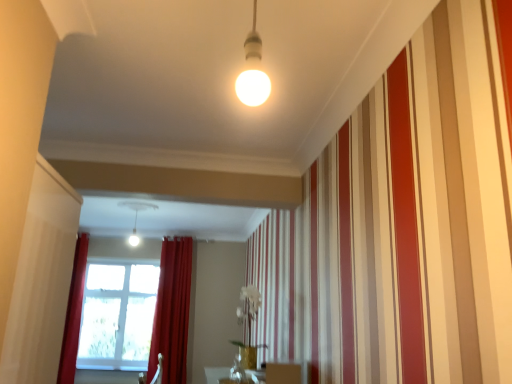
This screenshot has height=384, width=512. What do you see at coordinates (73, 313) in the screenshot?
I see `velvet red curtain at left, the first curtain when ordered from left to right` at bounding box center [73, 313].

What is the approximate width of matte white light fixture at center?

matte white light fixture at center is 15.95 inches in width.

You are a GUI agent. You are given a task and a screenshot of the screen. Output one action in this format:
    pyautogui.click(x=<x>, y=<y>)
    Task: Click on the matte gold vase at center
    This screenshot has height=384, width=512.
    Given the screenshot: What is the action you would take?
    pyautogui.click(x=283, y=373)

Does point (130, 203) come closer to viewer compared to point (65, 383)?

That is False.

Are matte white light fixture at center and velvet red curtain at left, positioned as the second curtain in right-to-left order, making contact?

No, matte white light fixture at center is not touching velvet red curtain at left, positioned as the second curtain in right-to-left order.

Is matte white light fixture at center located outside velvet red curtain at left, positioned as the second curtain in right-to-left order?

Absolutely, matte white light fixture at center is external to velvet red curtain at left, positioned as the second curtain in right-to-left order.

Starting from the matte white light fixture at center, which curtain is the 1st one behind? Please provide its 2D coordinates.

[(73, 313)]

Relative to matte white light fixture at center, is velvet red curtain at left, positioned as the second curtain in right-to-left order, in front or behind?

Visually, velvet red curtain at left, positioned as the second curtain in right-to-left order, is located behind matte white light fixture at center.

Is velvet red curtain at left, the first curtain when ordered from left to right, at the right side of matte white light fixture at center?

No, velvet red curtain at left, the first curtain when ordered from left to right, is not to the right of matte white light fixture at center.

Is velvet red curtain at left, positioned as the second curtain in right-to-left order, positioned beyond the bounds of matte white light fixture at center?

velvet red curtain at left, positioned as the second curtain in right-to-left order, is positioned outside matte white light fixture at center.

Is matte white light fixture at center oriented away from velvet red curtain at center, placed as the first curtain when sorted from right to left?

Yes.

Between matte white light fixture at center and velvet red curtain at center, placed as the first curtain when sorted from right to left, which one is positioned behind?

Positioned behind is velvet red curtain at center, placed as the first curtain when sorted from right to left.

Does point (126, 205) appear closer or farther from the camera than point (177, 312)?

Point (126, 205) is closer to the camera than point (177, 312).

From a real-world perspective, is matte white light fixture at center on top of velvet red curtain at center, placed as the first curtain when sorted from right to left?

Correct, in the physical world, matte white light fixture at center is higher than velvet red curtain at center, placed as the first curtain when sorted from right to left.

Does point (139, 290) appear closer or farther from the camera than point (281, 368)?

Point (139, 290) is farther from the camera than point (281, 368).

From a real-world perspective, between transparent glass window screen at lower left and matte gold vase at center, who is vertically higher?

In real-world perspective, transparent glass window screen at lower left is above.

Is transparent glass window screen at lower left facing towards matte gold vase at center?

No, transparent glass window screen at lower left is not turned towards matte gold vase at center.

Does transparent glass window screen at lower left have a smaller size compared to matte gold vase at center?

Incorrect, transparent glass window screen at lower left is not smaller in size than matte gold vase at center.

Can you confirm if matte gold vase at center is taller than matte white light fixture at center?

No, matte gold vase at center is not taller than matte white light fixture at center.

From the image's perspective, which object appears higher, matte gold vase at center or matte white light fixture at center?

matte white light fixture at center, from the image's perspective.

Is point (278, 376) farther from camera compared to point (137, 205)?

No, (278, 376) is closer to viewer.

Which is behind, matte gold vase at center or matte white light fixture at center?

Positioned behind is matte white light fixture at center.

Can you confirm if matte gold vase at center is taller than velvet red curtain at left, the first curtain when ordered from left to right?

No.

Could you tell me if matte gold vase at center is turned towards velvet red curtain at left, the first curtain when ordered from left to right?

No, matte gold vase at center is not aimed at velvet red curtain at left, the first curtain when ordered from left to right.

Which is less distant, (x=295, y=365) or (x=79, y=250)?

The point (x=295, y=365) is in front.

Would you say matte gold vase at center is to the left or to the right of velvet red curtain at left, the first curtain when ordered from left to right, in the picture?

In the image, matte gold vase at center appears on the right side of velvet red curtain at left, the first curtain when ordered from left to right.

Is velvet red curtain at center, arranged as the second curtain when viewed from the left, far from transparent glass window screen at lower left?

They are positioned close to each other.

Considering the sizes of objects velvet red curtain at center, arranged as the second curtain when viewed from the left, and transparent glass window screen at lower left in the image provided, who is thinner, velvet red curtain at center, arranged as the second curtain when viewed from the left, or transparent glass window screen at lower left?

Thinner between the two is transparent glass window screen at lower left.

Would you say transparent glass window screen at lower left is part of velvet red curtain at center, arranged as the second curtain when viewed from the left,'s contents?

No.

Where is `light fixture that appears above the velvet red curtain at left, the first curtain when ordered from left to right (from a real-world perspective)`? The height and width of the screenshot is (384, 512). light fixture that appears above the velvet red curtain at left, the first curtain when ordered from left to right (from a real-world perspective) is located at coordinates (136, 216).

From the matte white light fixture at center, count 1st curtains backward and point to it. Please provide its 2D coordinates.

[(73, 313)]

When comparing their distances from matte white light fixture at center, does matte gold vase at center or velvet red curtain at left, the first curtain when ordered from left to right, seem closer?

The object closer to matte white light fixture at center is velvet red curtain at left, the first curtain when ordered from left to right.

When comparing their distances from matte white light fixture at center, does matte gold vase at center or transparent glass window screen at lower left seem closer?

Among the two, matte gold vase at center is located nearer to matte white light fixture at center.

Considering their positions, is velvet red curtain at left, positioned as the second curtain in right-to-left order, positioned further to matte white light fixture at center than matte gold vase at center?

Among the two, matte gold vase at center is located further to matte white light fixture at center.

Which object lies nearer to the anchor point transparent glass window screen at lower left, velvet red curtain at left, the first curtain when ordered from left to right, or matte white light fixture at center?

velvet red curtain at left, the first curtain when ordered from left to right, is positioned closer to the anchor transparent glass window screen at lower left.

Looking at the image, which one is located further to velvet red curtain at left, positioned as the second curtain in right-to-left order, velvet red curtain at center, arranged as the second curtain when viewed from the left, or transparent glass window screen at lower left?

velvet red curtain at center, arranged as the second curtain when viewed from the left.

Based on their spatial positions, is velvet red curtain at center, placed as the first curtain when sorted from right to left, or velvet red curtain at left, positioned as the second curtain in right-to-left order, closer to matte white light fixture at center?

velvet red curtain at left, positioned as the second curtain in right-to-left order, is positioned closer to the anchor matte white light fixture at center.

Looking at the image, which one is located further to matte gold vase at center, matte white light fixture at center or transparent glass window screen at lower left?

transparent glass window screen at lower left.

Looking at the image, which one is located further to velvet red curtain at left, positioned as the second curtain in right-to-left order, matte white light fixture at center or velvet red curtain at center, arranged as the second curtain when viewed from the left?

Based on the image, matte white light fixture at center appears to be further to velvet red curtain at left, positioned as the second curtain in right-to-left order.

Locate an element on the screen. This screenshot has height=384, width=512. window screen between velvet red curtain at left, positioned as the second curtain in right-to-left order, and velvet red curtain at center, arranged as the second curtain when viewed from the left is located at coordinates (117, 316).

Where is `light fixture positioned between matte gold vase at center and velvet red curtain at left, positioned as the second curtain in right-to-left order, from near to far`? The height and width of the screenshot is (384, 512). light fixture positioned between matte gold vase at center and velvet red curtain at left, positioned as the second curtain in right-to-left order, from near to far is located at coordinates (136, 216).

Where is `light fixture between matte gold vase at center and velvet red curtain at center, placed as the first curtain when sorted from right to left, from front to back`? This screenshot has height=384, width=512. light fixture between matte gold vase at center and velvet red curtain at center, placed as the first curtain when sorted from right to left, from front to back is located at coordinates (136, 216).

Where is `curtain between matte gold vase at center and velvet red curtain at center, placed as the first curtain when sorted from right to left, in the front-back direction`? This screenshot has width=512, height=384. curtain between matte gold vase at center and velvet red curtain at center, placed as the first curtain when sorted from right to left, in the front-back direction is located at coordinates (73, 313).